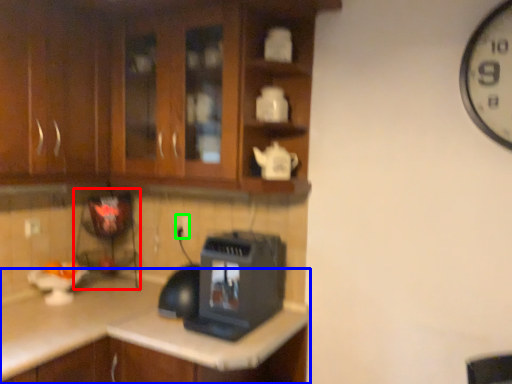
Question: Based on their relative distances, which object is nearer to appliance (highlighted by a red box)? Choose from countertop (highlighted by a blue box) and electric outlet (highlighted by a green box).

Choices:
 (A) countertop
 (B) electric outlet

Answer: (B)